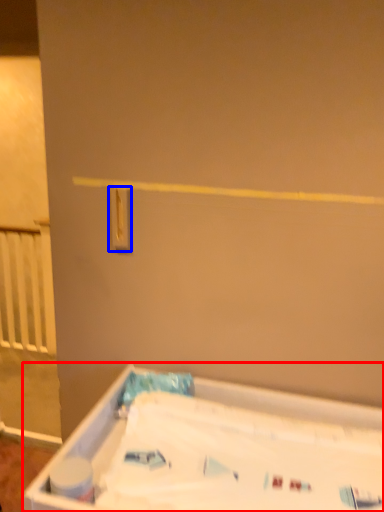
Question: Which object appears farthest to the camera in this image, bathtub (highlighted by a red box) or light switch (highlighted by a blue box)?

Choices:
 (A) bathtub
 (B) light switch

Answer: (B)